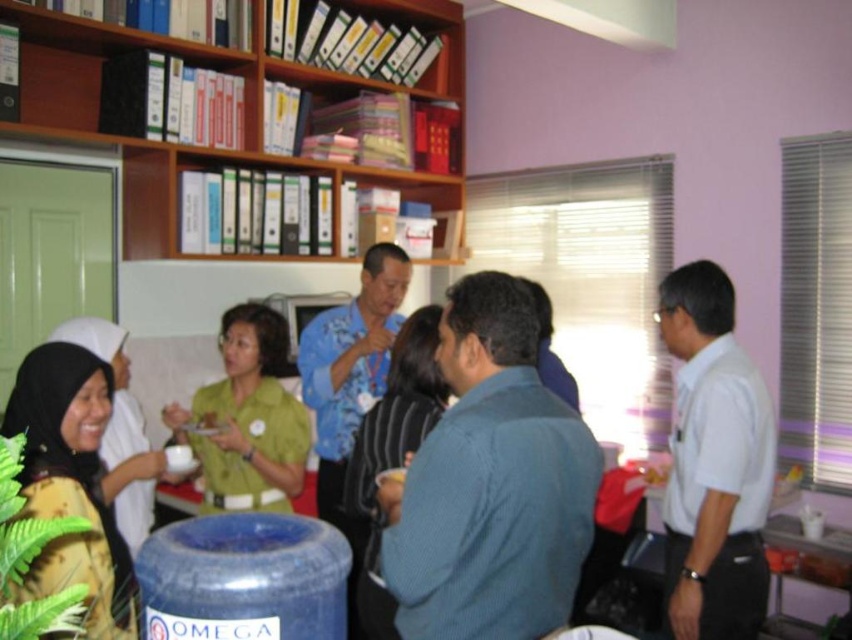
You are organizing a meeting in this room and need to place a name tag on the table. The name tag is 10 cm wide. There is a blue textured shirt at center and a wooden bookshelf at upper center. Can you fit the name tag between them?

The blue textured shirt at center is positioned on the right side of wooden bookshelf at upper center. Since the name tag is only 10 cm wide, it should fit between them if there is sufficient space. However, the exact distance isn not provided, so we cannot confirm definitively.

What are the coordinates of the blue textured shirt at center?

The coordinates of the blue textured shirt at center are at point (490, 483).